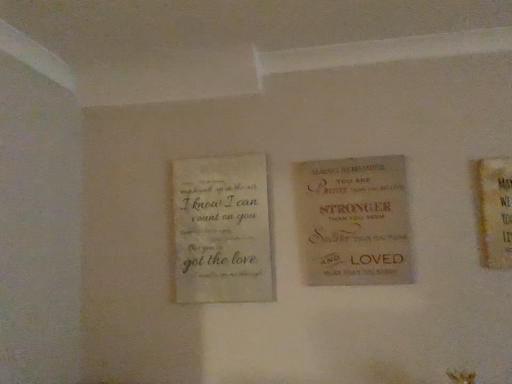
Question: Is beige textured canvas sign at center, placed as the first book when sorted from right to left, positioned before off-white textured paper at left, placed as the 1th book when sorted from left to right?

Choices:
 (A) no
 (B) yes

Answer: (B)

Question: Is beige textured canvas sign at center, the second book from the left, oriented towards off-white textured paper at left, placed as the 1th book when sorted from left to right?

Choices:
 (A) no
 (B) yes

Answer: (A)

Question: From a real-world perspective, does beige textured canvas sign at center, the second book from the left, stand above off-white textured paper at left, the second book positioned from the right?

Choices:
 (A) no
 (B) yes

Answer: (B)

Question: From the image's perspective, is beige textured canvas sign at center, the second book from the left, located beneath off-white textured paper at left, placed as the 1th book when sorted from left to right?

Choices:
 (A) no
 (B) yes

Answer: (A)

Question: Is beige textured canvas sign at center, the second book from the left, bigger than off-white textured paper at left, the second book positioned from the right?

Choices:
 (A) yes
 (B) no

Answer: (B)

Question: Does beige textured canvas sign at center, placed as the first book when sorted from right to left, have a smaller size compared to off-white textured paper at left, the second book positioned from the right?

Choices:
 (A) yes
 (B) no

Answer: (A)

Question: Is off-white textured paper at left, the second book positioned from the right, positioned behind beige textured canvas sign at center, placed as the first book when sorted from right to left?

Choices:
 (A) no
 (B) yes

Answer: (B)

Question: Is off-white textured paper at left, placed as the 1th book when sorted from left to right, to the right of beige textured canvas sign at center, the second book from the left, from the viewer's perspective?

Choices:
 (A) yes
 (B) no

Answer: (B)

Question: From a real-world perspective, is off-white textured paper at left, the second book positioned from the right, on beige textured canvas sign at center, placed as the first book when sorted from right to left?

Choices:
 (A) no
 (B) yes

Answer: (A)

Question: Could you tell me if off-white textured paper at left, placed as the 1th book when sorted from left to right, is turned towards beige textured canvas sign at center, placed as the first book when sorted from right to left?

Choices:
 (A) yes
 (B) no

Answer: (B)

Question: From the image's perspective, is off-white textured paper at left, the second book positioned from the right, on top of beige textured canvas sign at center, placed as the first book when sorted from right to left?

Choices:
 (A) no
 (B) yes

Answer: (A)

Question: Is off-white textured paper at left, placed as the 1th book when sorted from left to right, completely or partially outside of beige textured canvas sign at center, placed as the first book when sorted from right to left?

Choices:
 (A) no
 (B) yes

Answer: (B)

Question: Is beige textured canvas sign at center, placed as the first book when sorted from right to left, bigger or smaller than off-white textured paper at left, placed as the 1th book when sorted from left to right?

Choices:
 (A) small
 (B) big

Answer: (A)